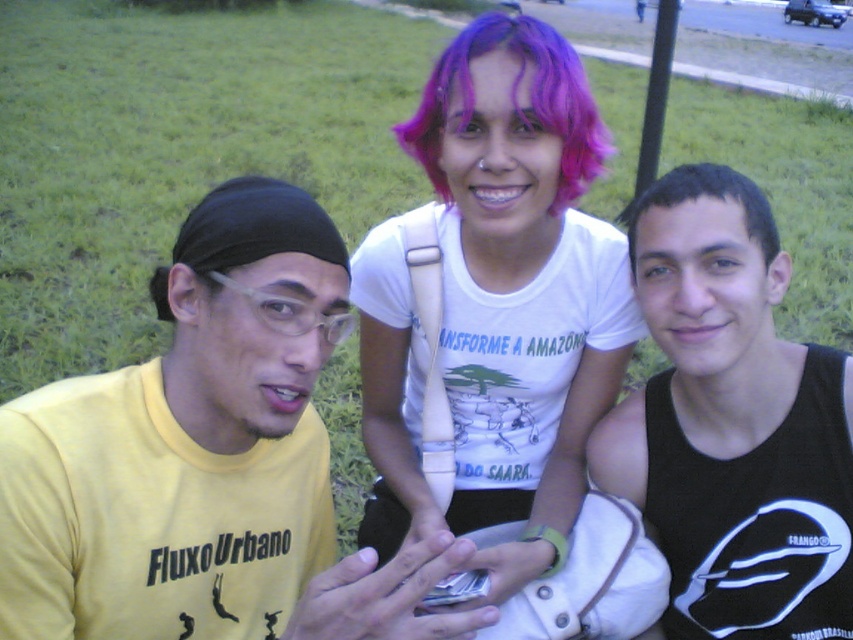
You are a photographer trying to capture a group photo of the purple hair at center and black tank top at right. Since you want to ensure both subjects are in frame, which direction should you position your camera relative to the group?

The purple hair at center is to the left of black tank top at right, so you should position your camera to the left side of the group to ensure both subjects are in frame.

You are a photographer trying to capture a candid shot of the group. You want to ensure the black tank top at right and the dark brown hair at right are both visible in the frame. Based on their positions, which object should you focus on first to ensure both are in the shot?

The black tank top at right is positioned under dark brown hair at right, so focusing on the dark brown hair at right first will ensure both are visible in the frame.

You are a photographer trying to capture a candid shot of the person wearing the black tank top at right without including the dark brown hair at right in the frame. Based on their positions, is this possible?

The black tank top at right is in front of the dark brown hair at right, so it is not possible to capture the black tank top at right without including the dark brown hair at right in the frame.